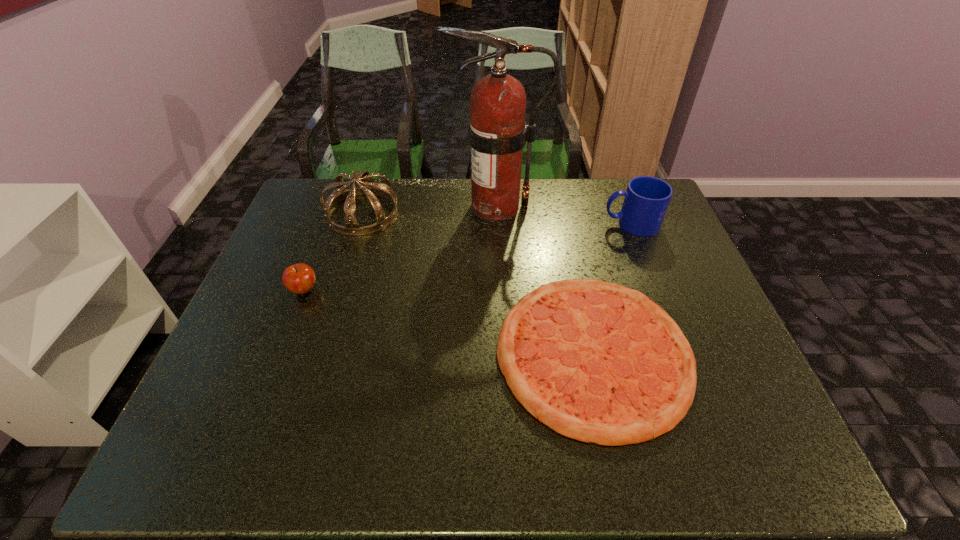
I want to click on the fourth closest object to the third tallest object, so click(299, 278).

Where is `object that can be found as the closest to the apple`? object that can be found as the closest to the apple is located at coordinates (367, 187).

This screenshot has height=540, width=960. Identify the location of free space that satisfies the following two spatial constraints: 1. at the nozzle of the pizza; 2. on the left side of the tallest object. (503, 353).

Image resolution: width=960 pixels, height=540 pixels. What are the coordinates of `free location that satisfies the following two spatial constraints: 1. on the side with the handle of the mug; 2. on the front side of the fourth tallest object` in the screenshot? It's located at (657, 290).

Where is `blank space that satisfies the following two spatial constraints: 1. at the nozzle of the shortest object; 2. on the right side of the tallest object`? The height and width of the screenshot is (540, 960). blank space that satisfies the following two spatial constraints: 1. at the nozzle of the shortest object; 2. on the right side of the tallest object is located at coordinates (503, 353).